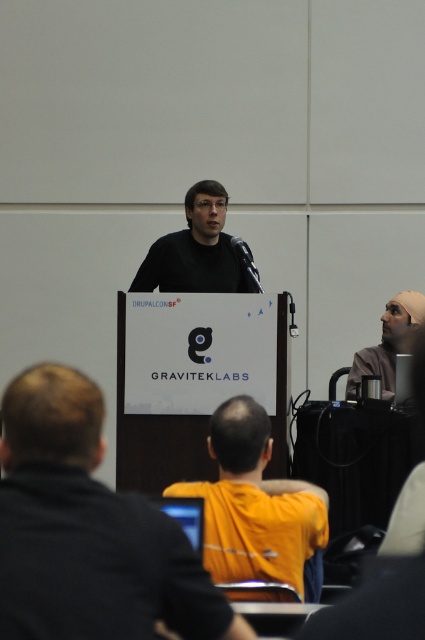
Which is above, yellow fabric shirt at center or yellow fabric shirt at lower center?

yellow fabric shirt at center

Does yellow fabric shirt at center appear on the right side of yellow fabric shirt at lower center?

In fact, yellow fabric shirt at center is to the left of yellow fabric shirt at lower center.

Between point (6, 592) and point (226, 486), which one is positioned in front?

Positioned in front is point (6, 592).

Identify the location of yellow fabric shirt at center. The width and height of the screenshot is (425, 640). (87, 531).

Is point (246, 579) in front of point (407, 301)?

Yes, it is in front of point (407, 301).

The image size is (425, 640). In order to click on yellow fabric shirt at lower center in this screenshot , I will do `click(255, 506)`.

Is point (263, 566) closer to viewer compared to point (384, 387)?

Yes, point (263, 566) is in front of point (384, 387).

Identify the location of yellow fabric shirt at lower center. This screenshot has width=425, height=640. (255, 506).

Is matte black shirt at center wider than matte black beanie at upper right?

Yes.

Can you confirm if matte black shirt at center is shorter than matte black beanie at upper right?

No.

The image size is (425, 640). In order to click on matte black shirt at center in this screenshot , I will do `click(197, 250)`.